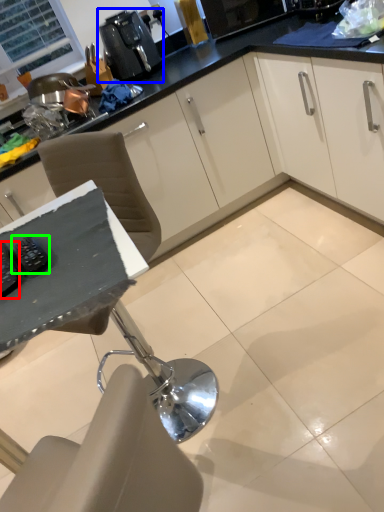
Question: Considering the real-world distances, which object is closest to appliance (highlighted by a red box)? coffee machine (highlighted by a blue box) or appliance (highlighted by a green box).

Choices:
 (A) coffee machine
 (B) appliance

Answer: (B)